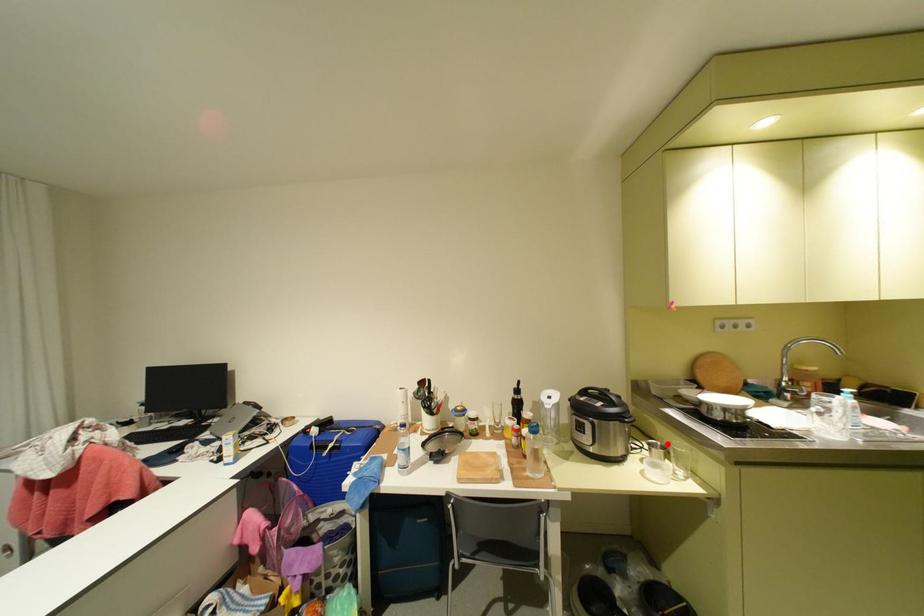
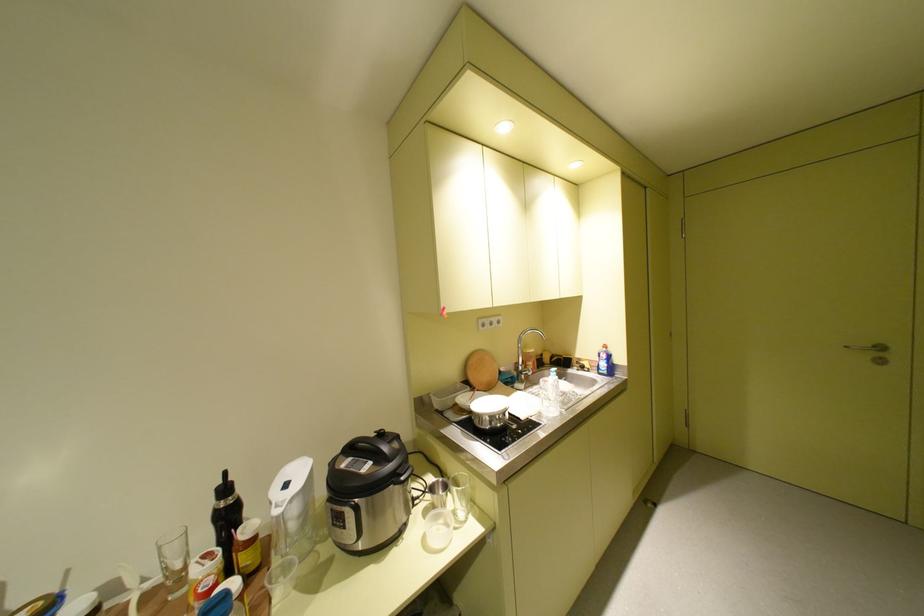
Locate, in the second image, the point that corresponds to the highlighted location in the first image.

(450, 482)